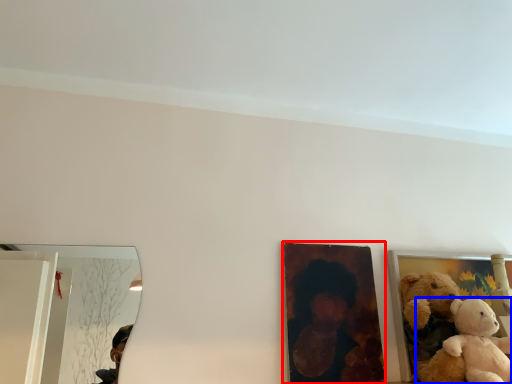
Question: Which of the following is the farthest to the observer, picture frame (highlighted by a red box) or teddy bear (highlighted by a blue box)?

Choices:
 (A) picture frame
 (B) teddy bear

Answer: (A)